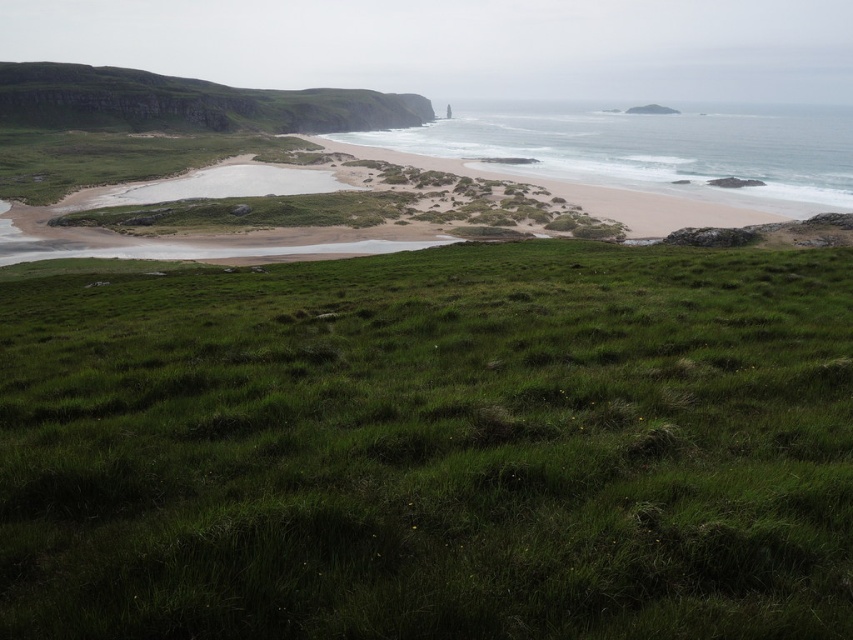
Does white sandy beach at center have a greater width compared to green grassy hillside at upper left?

Yes, white sandy beach at center is wider than green grassy hillside at upper left.

Based on the photo, who is more distant from viewer, (782, 154) or (142, 90)?

The point (142, 90) is more distant.

Locate an element on the screen. The image size is (853, 640). white sandy beach at center is located at coordinates (653, 148).

Is green grassy field at lower center taller than green grassy hillside at upper left?

Incorrect, green grassy field at lower center's height is not larger of green grassy hillside at upper left's.

Is point (836, 570) in front of point (141, 109)?

That is True.

This screenshot has width=853, height=640. In order to click on green grassy field at lower center in this screenshot , I will do `click(432, 448)`.

Between green grassy field at lower center and white sandy beach at center, which one appears on the left side from the viewer's perspective?

green grassy field at lower center is more to the left.

Is green grassy field at lower center thinner than white sandy beach at center?

Yes.

Does point (78, 385) come closer to viewer compared to point (407, 141)?

Yes.

Where is `green grassy field at lower center`? Image resolution: width=853 pixels, height=640 pixels. green grassy field at lower center is located at coordinates (432, 448).